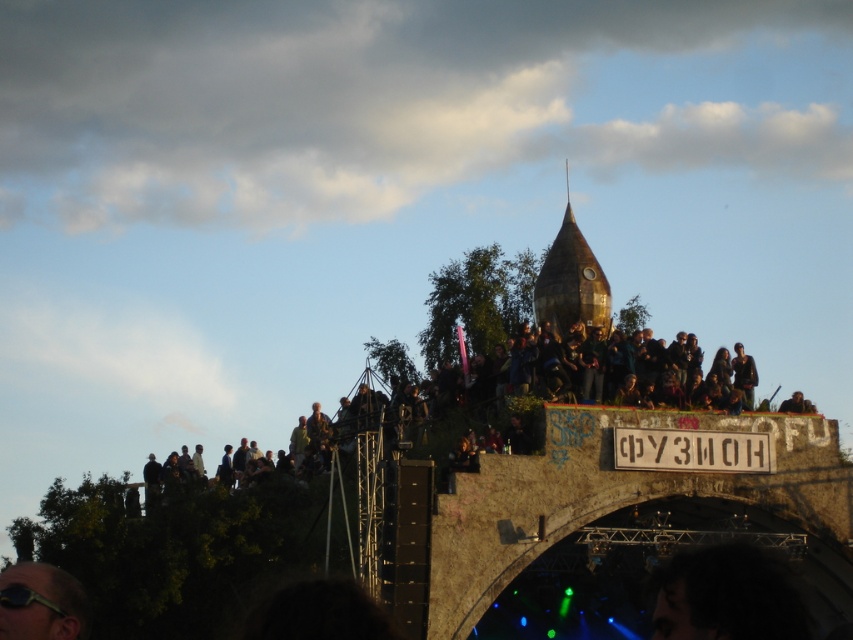
You are a photographer trying to capture a wide shot of the gold metallic dome at center and the matte black sunglasses at lower left. Considering their sizes, which object should you focus on to ensure both fit in the frame without cropping?

The gold metallic dome at center is wider than the matte black sunglasses at lower left, so you should focus on the gold metallic dome at center to ensure both fit in the frame without cropping.

You are a photographer trying to capture the entire scene of the festival. You have a camera with a standard lens that can only focus on objects up to 20 meters away. The stone bridge at upper center is 18 meters away from your position, and the matte black sunglasses at lower left are 22 meters away. Can your camera focus on both objects simultaneously?

The stone bridge at upper center is 18 meters away, which is within the camera lens range, but the matte black sunglasses at lower left are 22 meters away, exceeding the maximum focus distance of 20 meters. Therefore, the camera can focus on the stone bridge at upper center but not on the matte black sunglasses at lower left.

You are a photographer planning to capture the entire scene of the stone bridge at upper center and the gold metallic dome at center in a single shot. Given that your camera has a fixed field of view, which object should you position closer to the center of the frame to ensure both are fully visible?

Since the stone bridge at upper center is wider than the gold metallic dome at center, positioning the stone bridge at upper center closer to the center of the frame will help balance the composition and ensure both objects are fully visible within the camera frame.